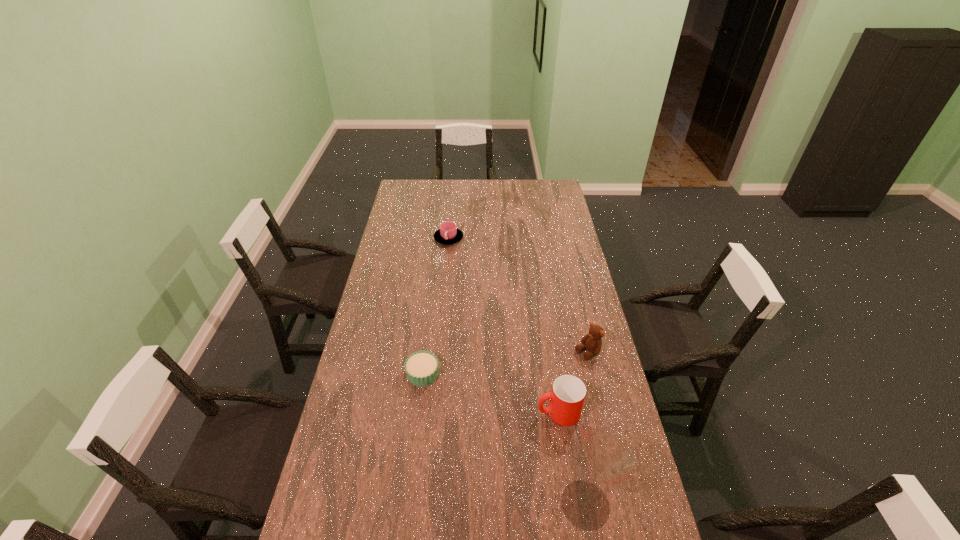
Find the location of a particular element. free point that satisfies the following two spatial constraints: 1. on the back side of the teddy bear; 2. on the left side of the nearer cup is located at coordinates (549, 353).

Image resolution: width=960 pixels, height=540 pixels. I want to click on vacant region that satisfies the following two spatial constraints: 1. on the back side of the cupcake; 2. on the right side of the teddy bear, so click(x=425, y=353).

This screenshot has height=540, width=960. I want to click on vacant space that satisfies the following two spatial constraints: 1. on the back side of the nearest object; 2. on the right side of the teddy bear, so click(x=559, y=353).